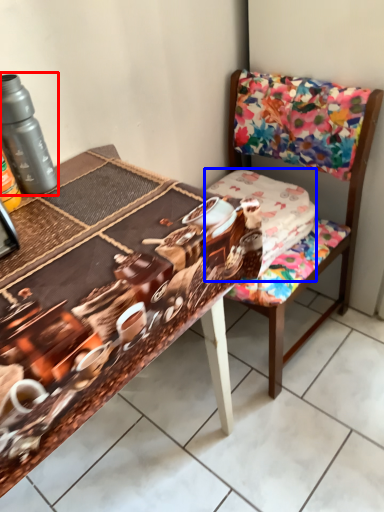
Question: Which point is closer to the camera, bottle (highlighted by a red box) or fabric (highlighted by a blue box)?

Choices:
 (A) bottle
 (B) fabric

Answer: (A)